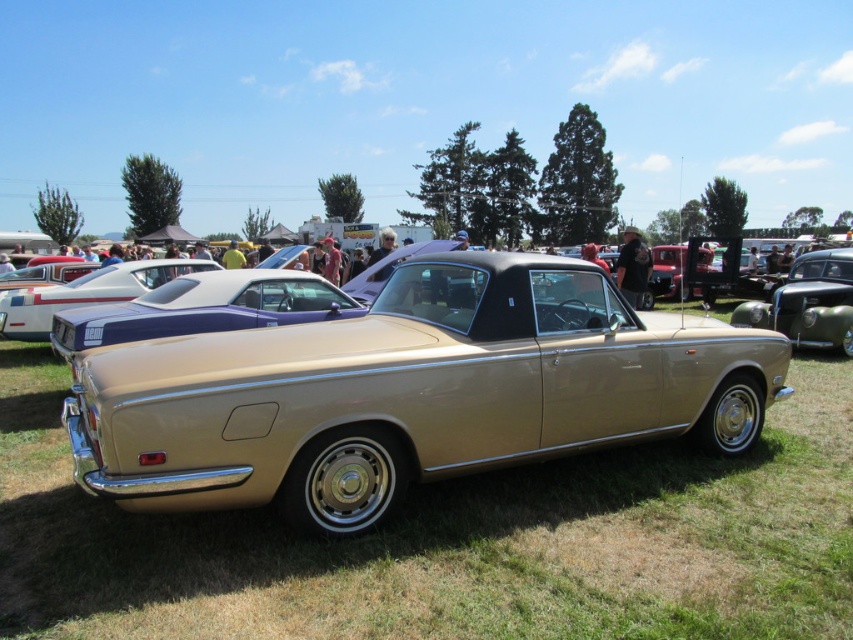
Question: Is gold metallic convertible at center positioned in front of metallic gold car at center?

Choices:
 (A) yes
 (B) no

Answer: (A)

Question: Which point is farther to the camera?

Choices:
 (A) (692, 316)
 (B) (837, 312)
 (C) (38, 301)

Answer: (B)

Question: In this image, where is gold metallic convertible at center located relative to shiny blue car at center?

Choices:
 (A) below
 (B) above

Answer: (A)

Question: Does metallic gold car at center appear under shiny blue car at center?

Choices:
 (A) yes
 (B) no

Answer: (B)

Question: Which point is farther to the camera?

Choices:
 (A) shiny blue car at center
 (B) metallic gold car at center
 (C) gold metallic convertible at center

Answer: (B)

Question: Which of the following is the closest to the observer?

Choices:
 (A) (84, 292)
 (B) (434, 394)
 (C) (798, 256)

Answer: (B)